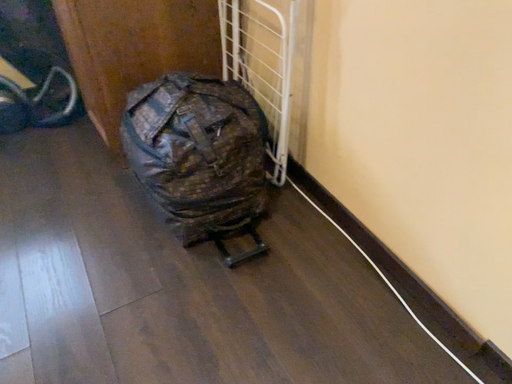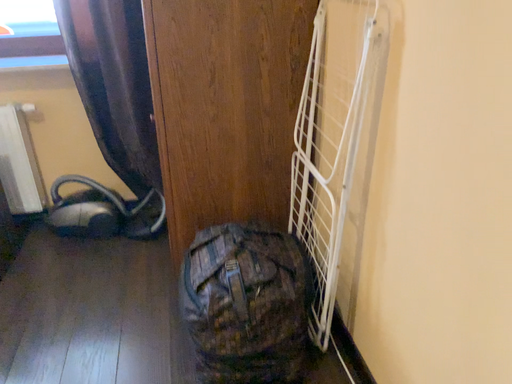
Question: How did the camera likely rotate when shooting the video?

Choices:
 (A) rotated upward
 (B) rotated downward

Answer: (A)